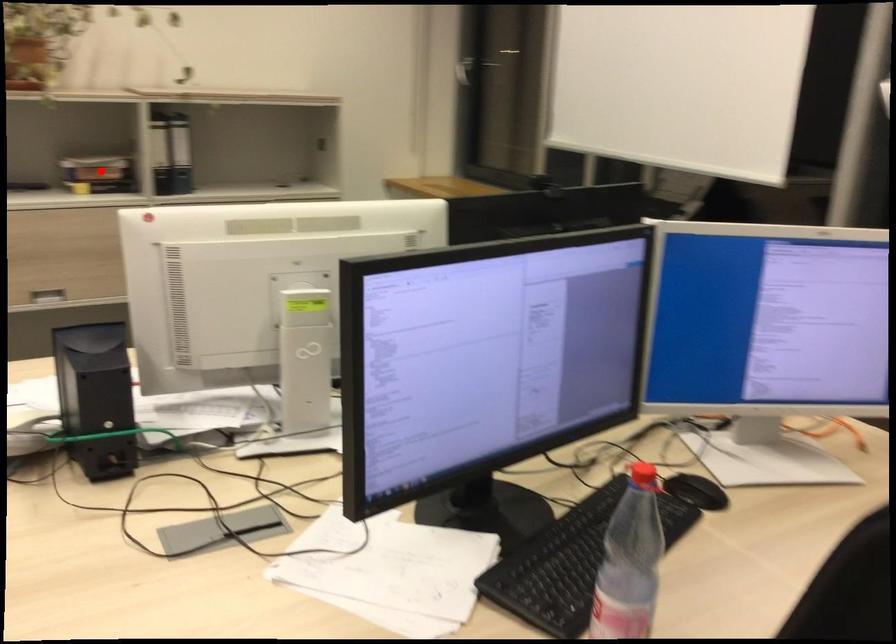
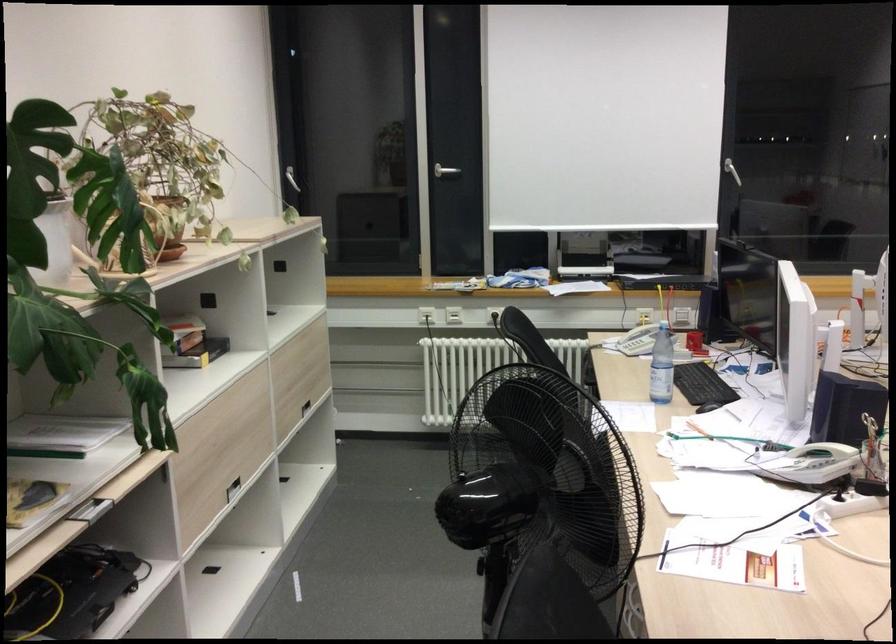
The point at the highlighted location is marked in the first image. Where is the corresponding point in the second image?

(192, 343)